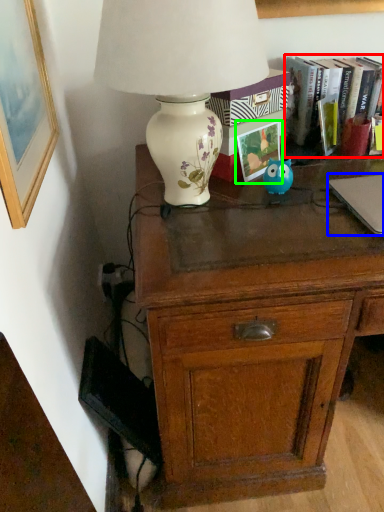
Question: Which object is the closest to the book (highlighted by a red box)? Choose among these: laptop (highlighted by a blue box) or paperback book (highlighted by a green box).

Choices:
 (A) laptop
 (B) paperback book

Answer: (B)